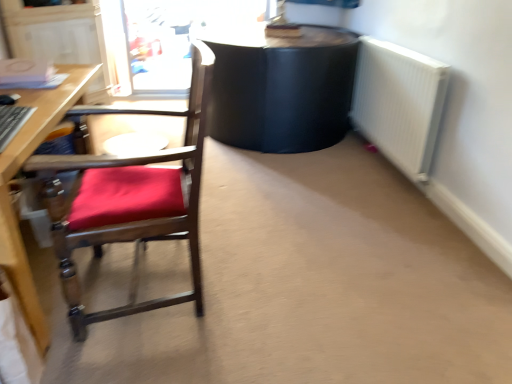
I want to click on free point below wooden chair with red cushion at left (from a real-world perspective), so click(157, 289).